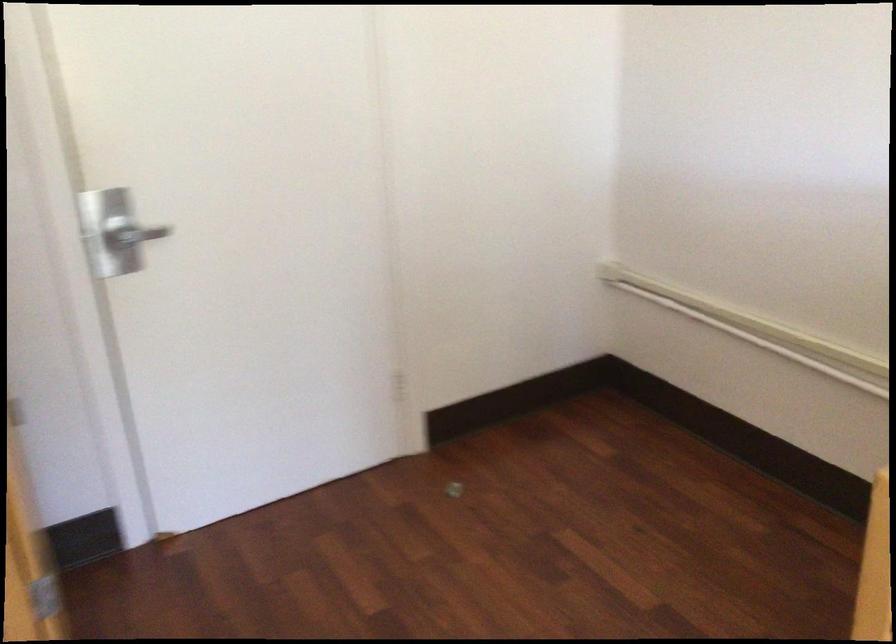
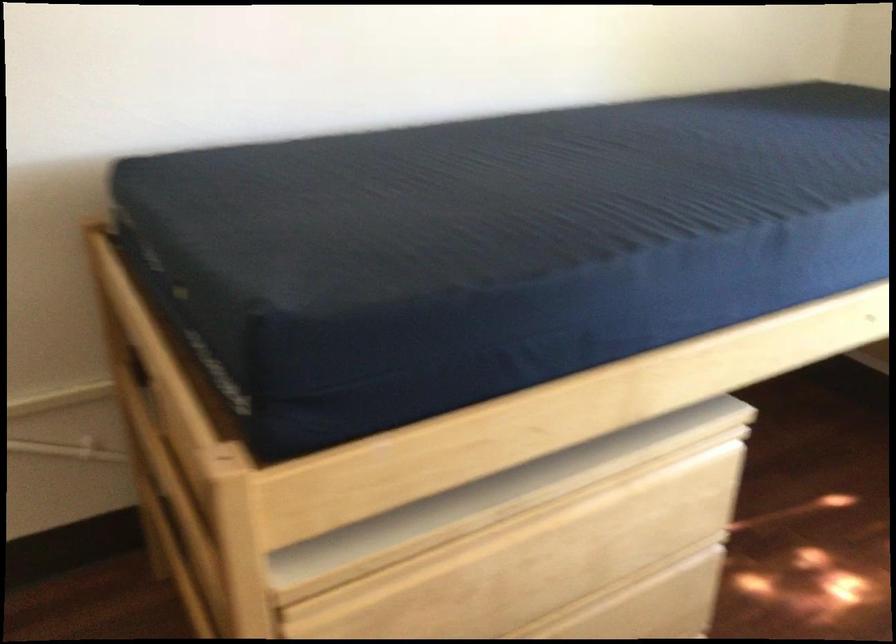
How did the camera likely rotate?

The rotation direction of the camera is right-down.